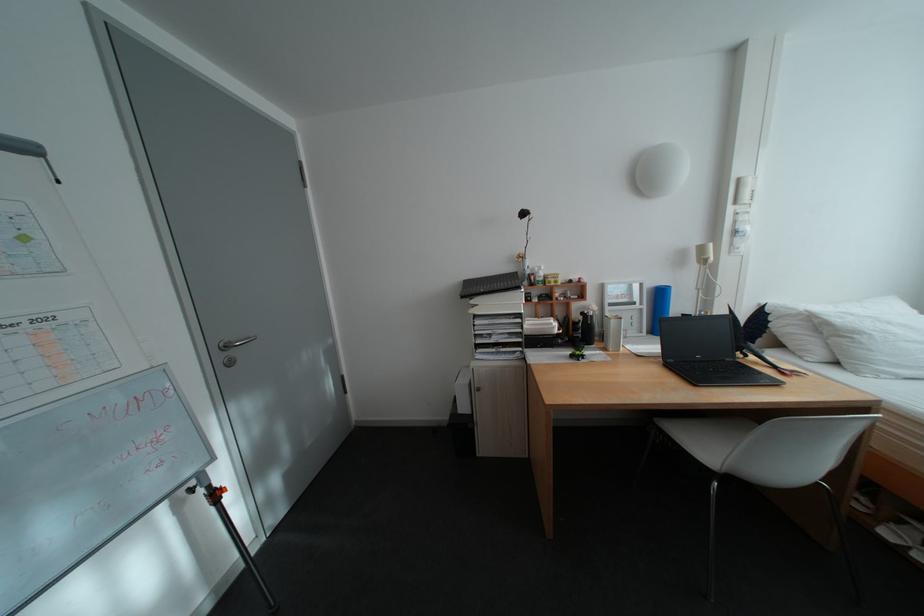
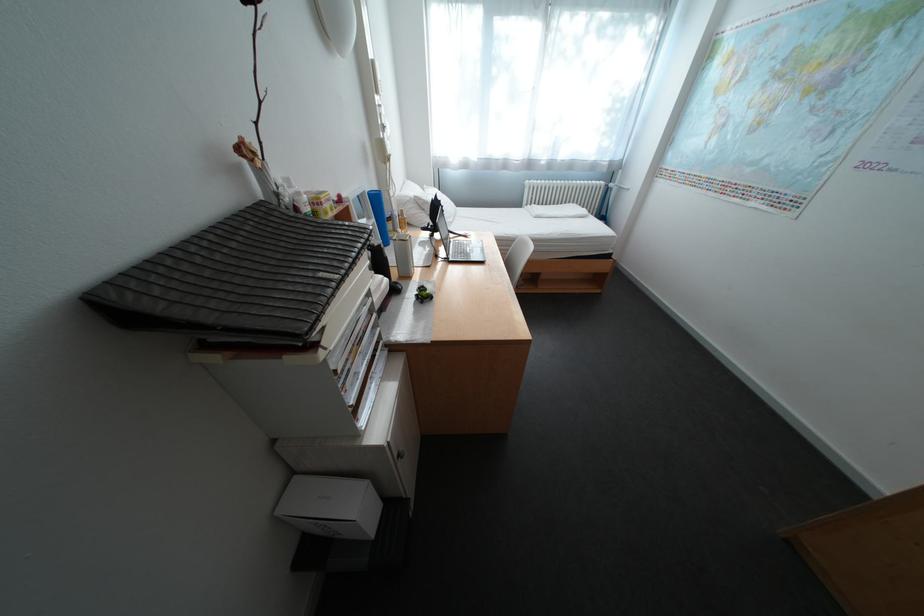
Where in the second image is the point corresponding to point (786, 368) from the first image?

(472, 236)